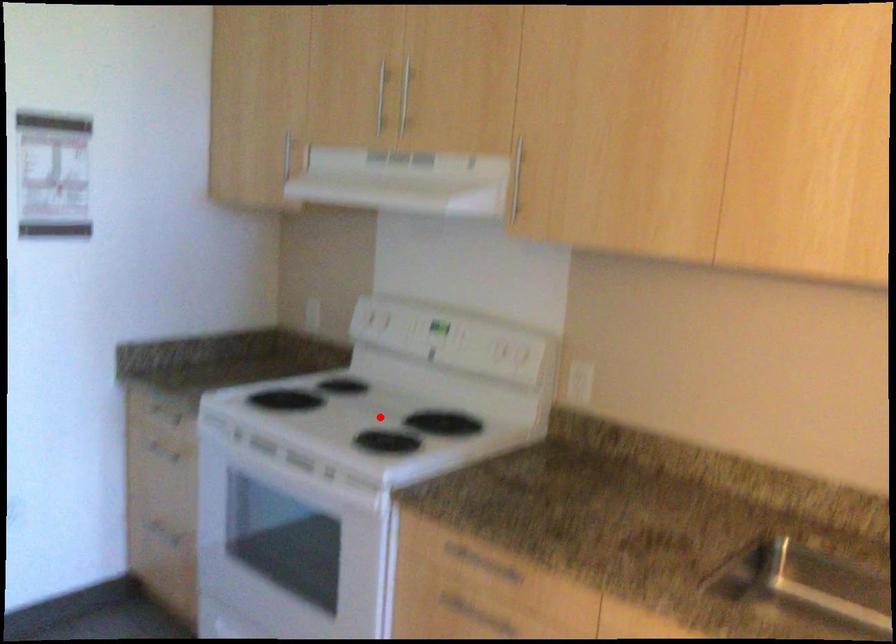
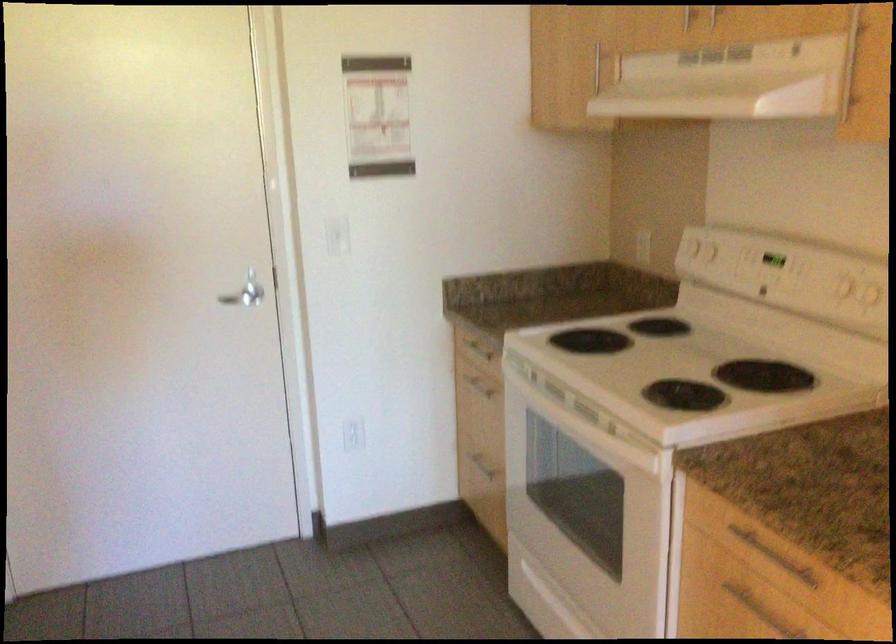
Question: I am providing you with two images of the same scene from different viewpoints. In image1, a red point is highlighted. Considering the same 3D point in image2, which of the following is correct?

Choices:
 (A) It is closer
 (B) It is farther

Answer: (A)